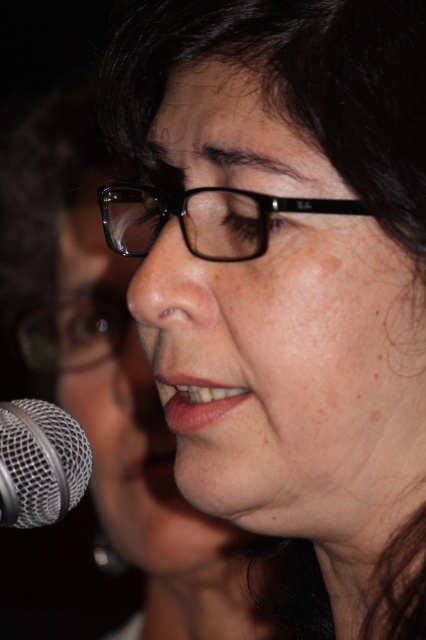
You are a photographer adjusting your camera settings. You notice two points in the scene labeled as point (144, 248) and point (37, 492). Which point should you focus on to ensure it appears sharp in the final photo if you want the closest object to the camera to be in focus?

Point (144, 248) is closer to the camera than point (37, 492), so you should focus on point (144, 248) to ensure it appears sharp in the final photo since it is the closest object to the camera.

From the picture: You are a photographer adjusting your camera to focus on the silver mesh microphone at lower left. According to the coordinates provided, is the microphone positioned closer to the top or bottom edge of the image?

The silver mesh microphone at lower left is positioned closer to the bottom edge of the image since its y coordinate is 0.094, which is closer to 0, indicating proximity to the bottom.

You are a photographer adjusting the focus on your camera. You need to ensure both the black plastic glasses at center and the silver mesh microphone at lower left are in focus. Which object should you adjust the focus for first, considering their relative sizes?

The black plastic glasses at center is not as tall as the silver mesh microphone at lower left, so you should adjust the focus for the silver mesh microphone at lower left first since it is larger and requires more precise focus.